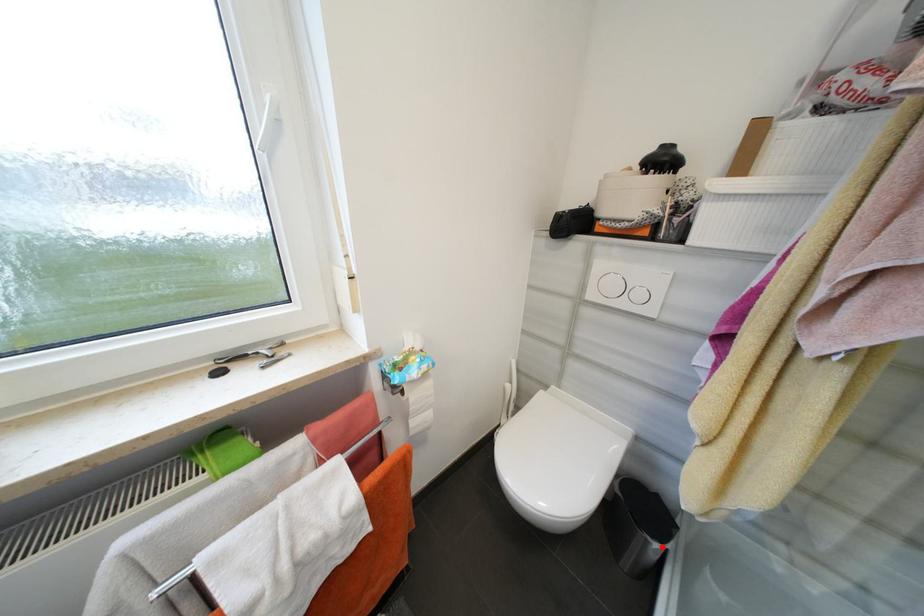
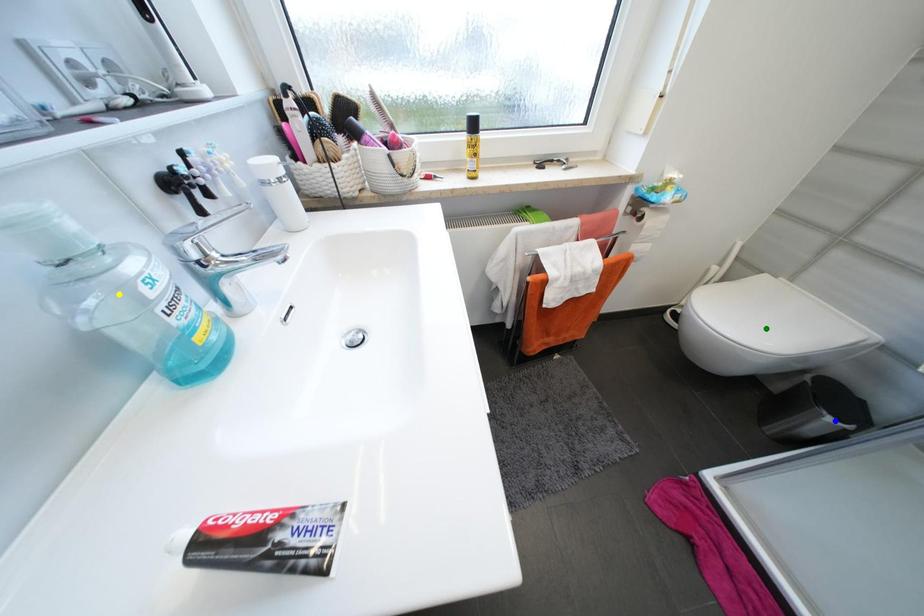
Question: I am providing you with two images of the same scene from different viewpoints. A red point is marked on the first image. You are given multiple points on the second image. In image 2, which mark is for the same physical point as the one in image 1?

Choices:
 (A) green point
 (B) blue point
 (C) yellow point

Answer: (B)